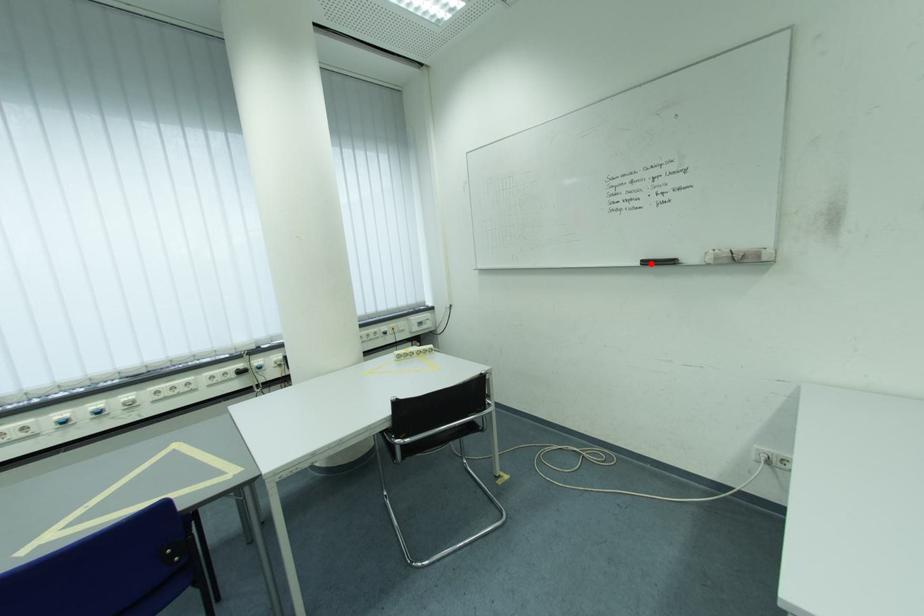
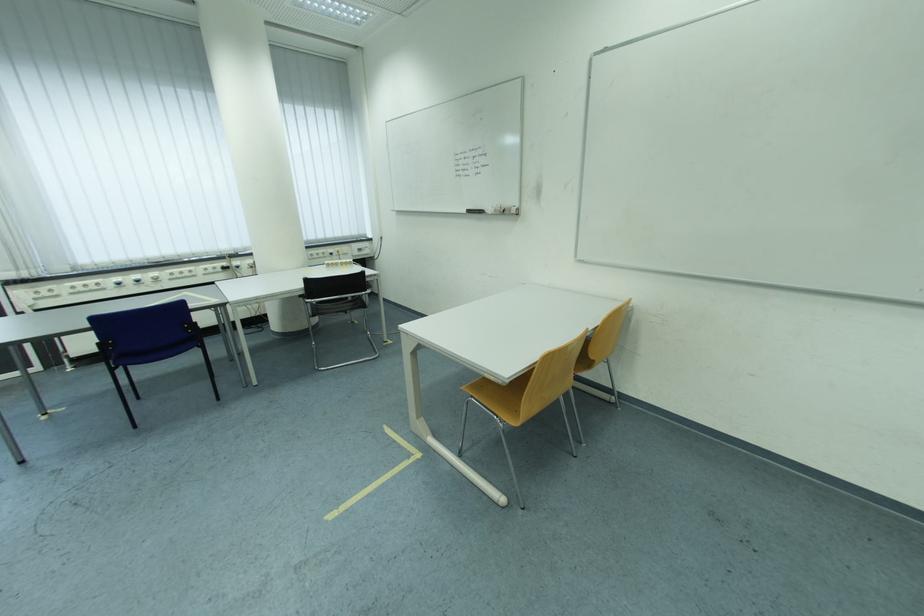
The point at the highlighted location is marked in the first image. Where is the corresponding point in the second image?

(476, 213)